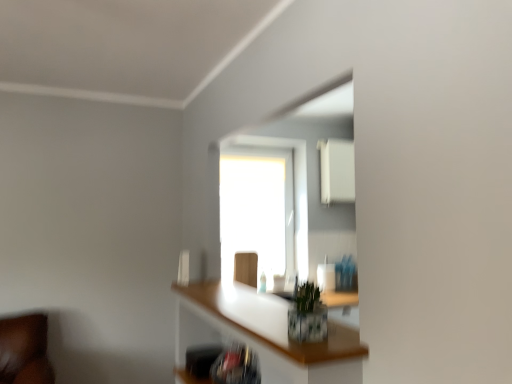
Identify the location of free location to the right of green leafy plant at center. Image resolution: width=512 pixels, height=384 pixels. (345, 337).